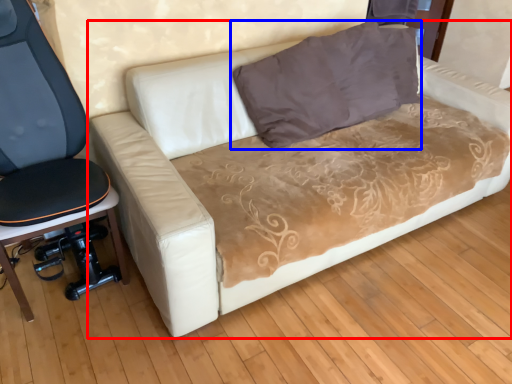
Question: Which object appears farthest to the camera in this image, studio couch (highlighted by a red box) or pillow (highlighted by a blue box)?

Choices:
 (A) studio couch
 (B) pillow

Answer: (B)